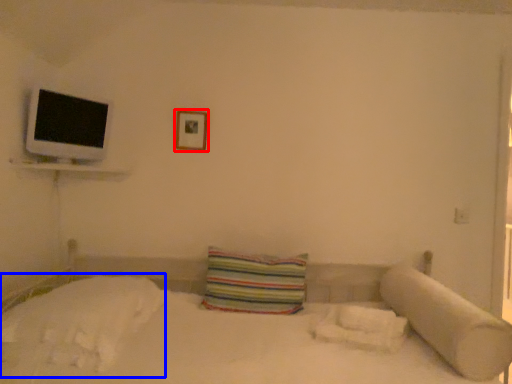
Question: Which object is further to the camera taking this photo, picture frame (highlighted by a red box) or sheet (highlighted by a blue box)?

Choices:
 (A) picture frame
 (B) sheet

Answer: (A)